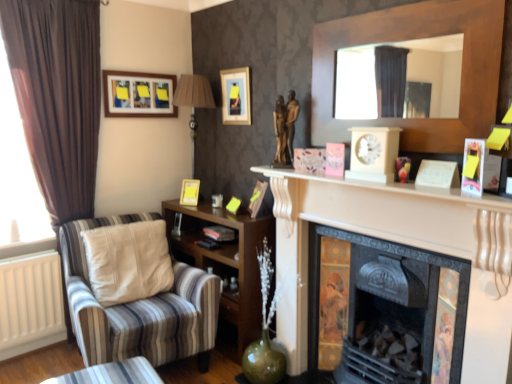
Question: Is striped fabric armchair at left placed right next to bronze statue at center?

Choices:
 (A) yes
 (B) no

Answer: (B)

Question: Does striped fabric armchair at left appear on the right side of bronze statue at center?

Choices:
 (A) yes
 (B) no

Answer: (B)

Question: Can you confirm if striped fabric armchair at left is thinner than bronze statue at center?

Choices:
 (A) yes
 (B) no

Answer: (B)

Question: Is striped fabric armchair at left located outside bronze statue at center?

Choices:
 (A) yes
 (B) no

Answer: (A)

Question: From a real-world perspective, does striped fabric armchair at left sit lower than bronze statue at center?

Choices:
 (A) yes
 (B) no

Answer: (A)

Question: Is striped fabric armchair at left bigger than bronze statue at center?

Choices:
 (A) no
 (B) yes

Answer: (B)

Question: Is brown fabric curtain at left outside of wooden shelf at lower left?

Choices:
 (A) no
 (B) yes

Answer: (B)

Question: Can you confirm if brown fabric curtain at left is bigger than wooden shelf at lower left?

Choices:
 (A) no
 (B) yes

Answer: (A)

Question: Are brown fabric curtain at left and wooden shelf at lower left far apart?

Choices:
 (A) yes
 (B) no

Answer: (A)

Question: Is brown fabric curtain at left in front of wooden shelf at lower left?

Choices:
 (A) yes
 (B) no

Answer: (A)

Question: Considering the relative sizes of brown fabric curtain at left and wooden shelf at lower left in the image provided, is brown fabric curtain at left taller than wooden shelf at lower left?

Choices:
 (A) yes
 (B) no

Answer: (A)

Question: Is brown fabric curtain at left positioned with its back to wooden shelf at lower left?

Choices:
 (A) yes
 (B) no

Answer: (B)

Question: Could you tell me if brown fabric curtain at left is turned towards matte wooden picture frame at upper left, the 1th picture frame when ordered from top to bottom?

Choices:
 (A) yes
 (B) no

Answer: (B)